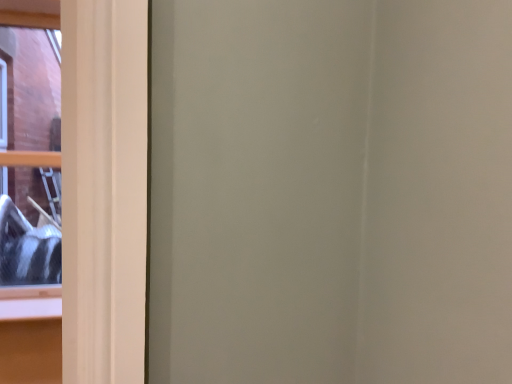
This screenshot has width=512, height=384. What do you see at coordinates (27, 283) in the screenshot?
I see `clear glass window at left` at bounding box center [27, 283].

The height and width of the screenshot is (384, 512). In order to click on clear glass window at left in this screenshot , I will do `click(27, 283)`.

In order to click on clear glass window at left in this screenshot , I will do `click(27, 283)`.